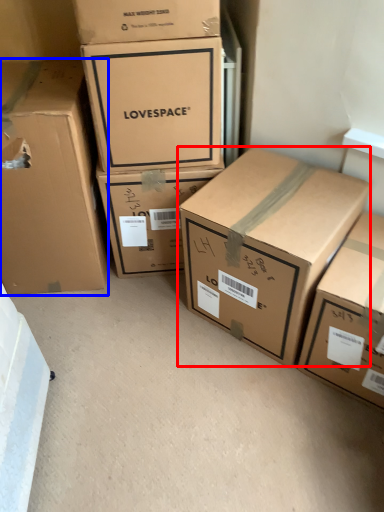
Question: Which point is closer to the camera, box (highlighted by a red box) or box (highlighted by a blue box)?

Choices:
 (A) box
 (B) box

Answer: (A)